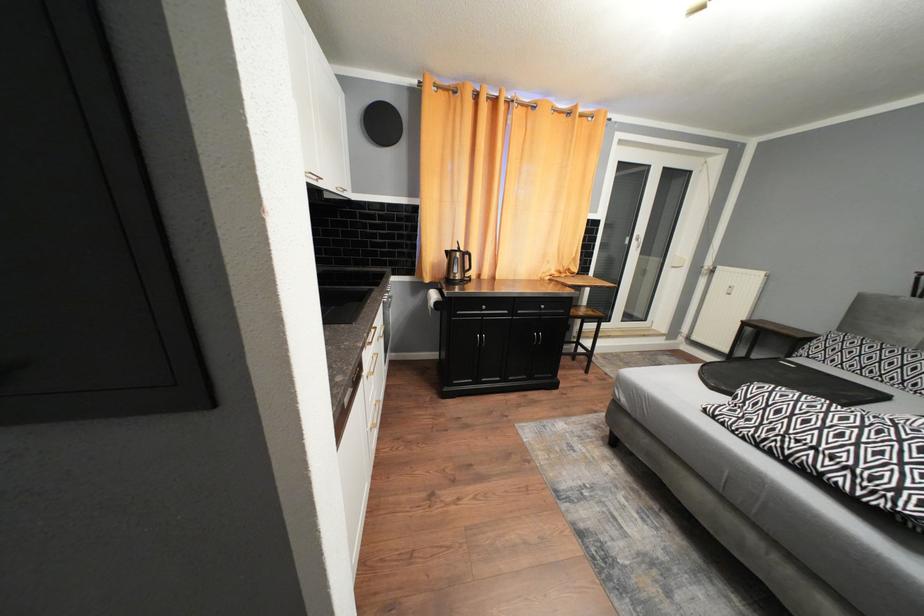
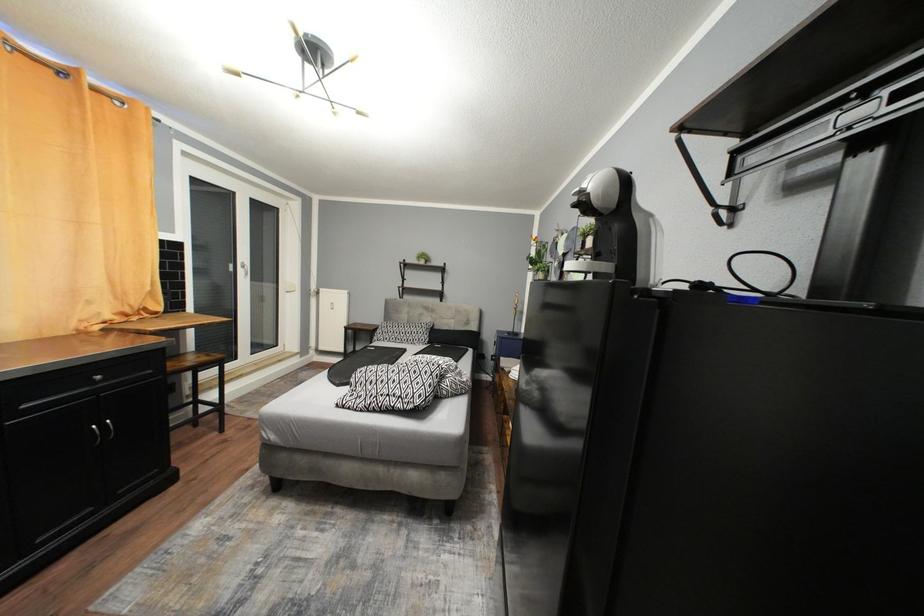
Question: Based on the continuous images, in which direction is the camera rotating? Reply with the corresponding letter.

Choices:
 (A) Left
 (B) Right
 (C) Up
 (D) Down

Answer: (B)